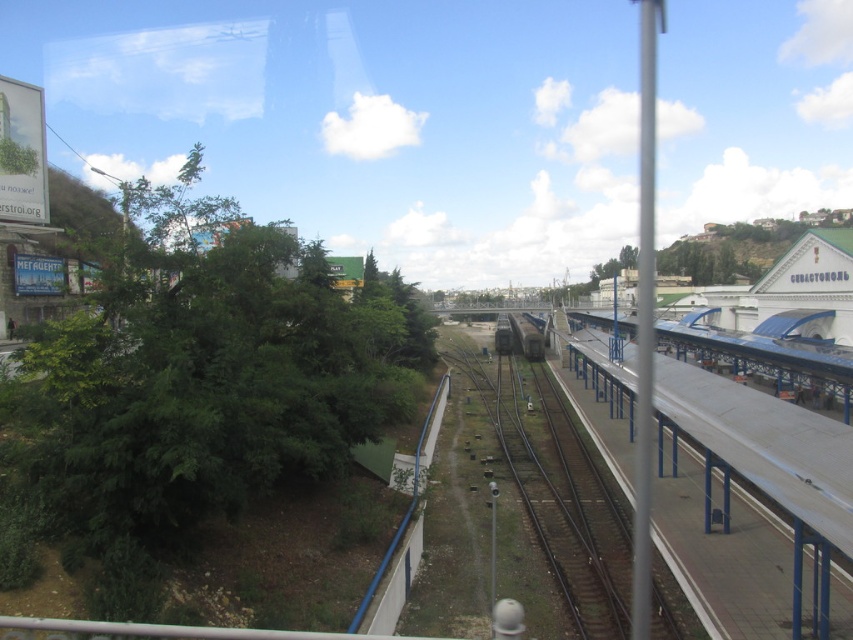
You are standing at the railway station platform on the right side of the tracks. You want to take a photo of the green leafy tree at left from your current position. Is the tree visible from where you are standing?

The green leafy tree at left is partially obscured by dense greenery and buildings, so it might not be fully visible from the platform on the right side of the tracks.

You are a passenger waiting on the platform to board the metallic gray train at center. You notice a green leafy tree at left in your line of sight. Which object is nearer to you as you wait?

The green leafy tree at left is closer to the viewer than the metallic gray train at center, so the tree is nearer to you.